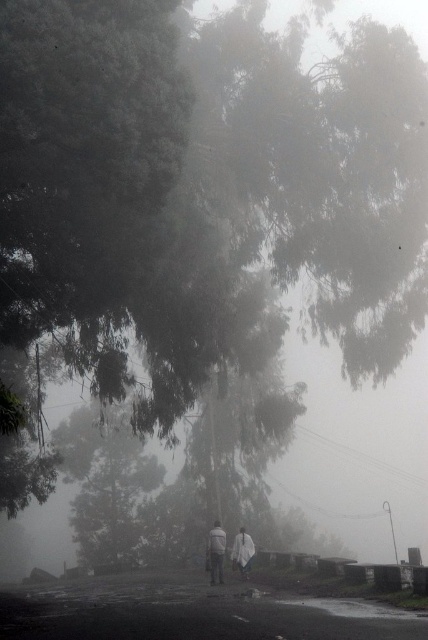
Question: Which of the following is the closest to the observer?

Choices:
 (A) (241, 573)
 (B) (214, 560)

Answer: (B)

Question: Which point is farther from the camera taking this photo?

Choices:
 (A) tap(219, 563)
 (B) tap(243, 552)

Answer: (B)

Question: Where is white matte jacket at lower center located in relation to white matte jacket at center in the image?

Choices:
 (A) right
 (B) left

Answer: (B)

Question: In this image, where is white matte coat at center located relative to white matte jacket at lower center?

Choices:
 (A) below
 (B) above

Answer: (A)

Question: Can you confirm if white matte jacket at lower center is positioned below white matte jacket at center?

Choices:
 (A) yes
 (B) no

Answer: (B)

Question: Which object appears closest to the camera in this image?

Choices:
 (A) white matte jacket at center
 (B) white matte jacket at lower center

Answer: (B)